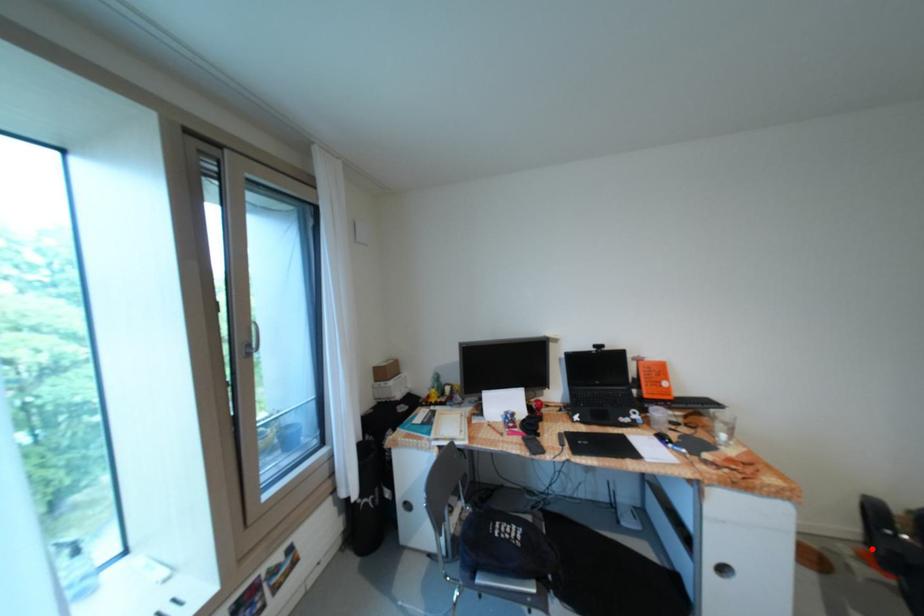
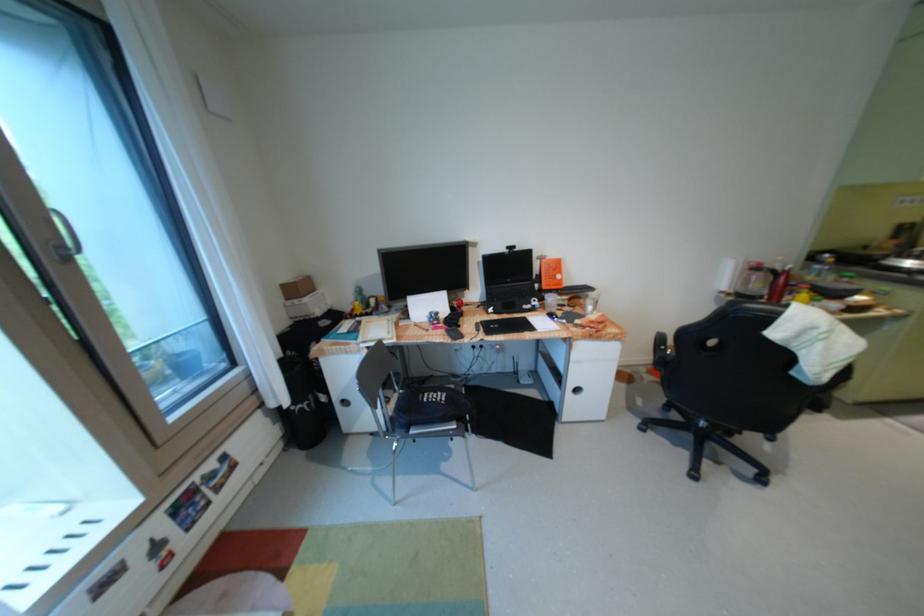
In the second image, find the point that corresponds to the highlighted location in the first image.

(661, 368)